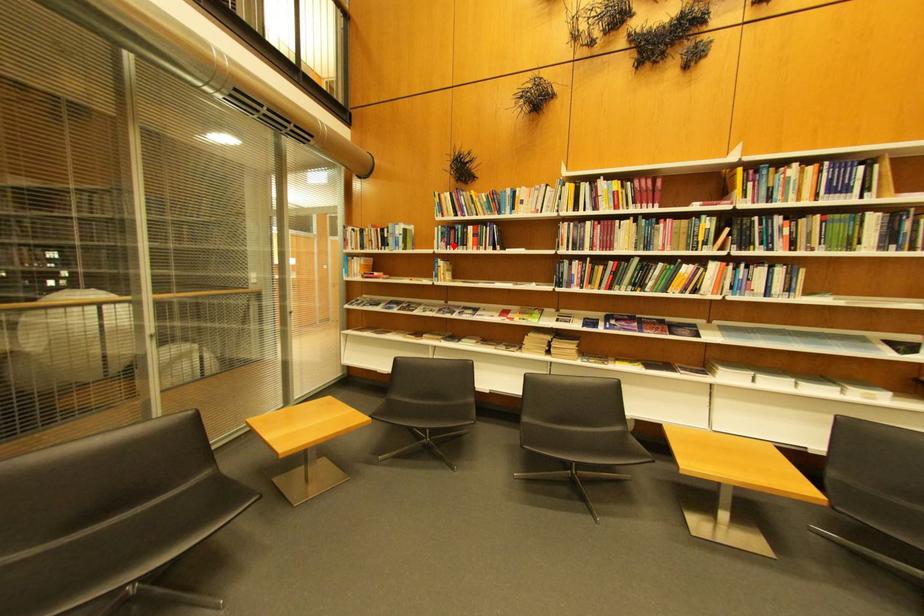
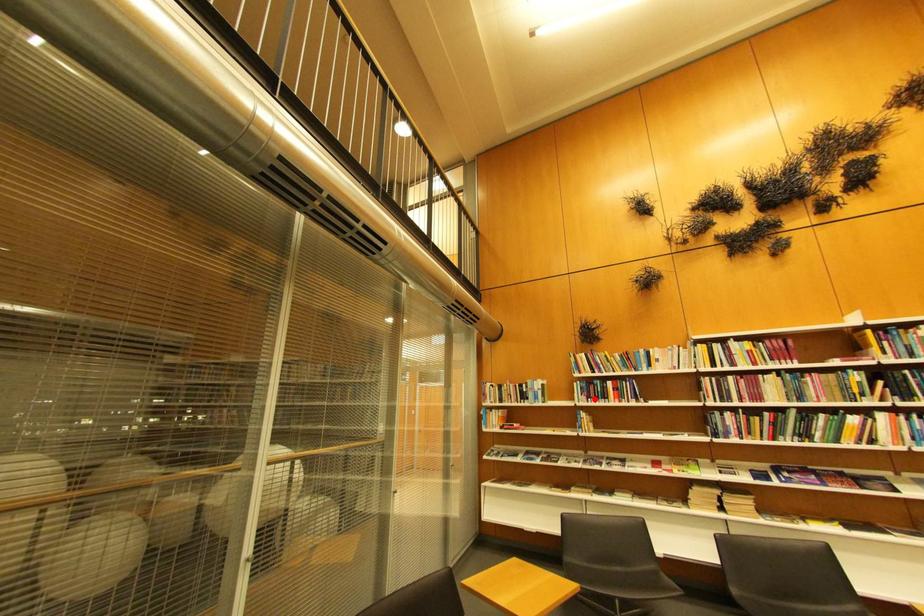
I am providing you with two images of the same scene from different viewpoints. A red point is marked on the first image and another point is marked on the second image. Does the point marked in image1 correspond to the same location as the one in image2?

Yes